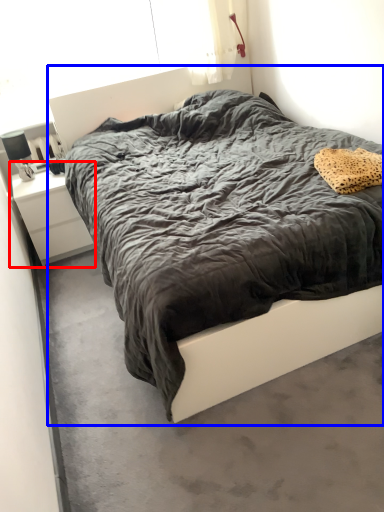
Question: Which object appears farthest to the camera in this image, nightstand (highlighted by a red box) or bed (highlighted by a blue box)?

Choices:
 (A) nightstand
 (B) bed

Answer: (A)